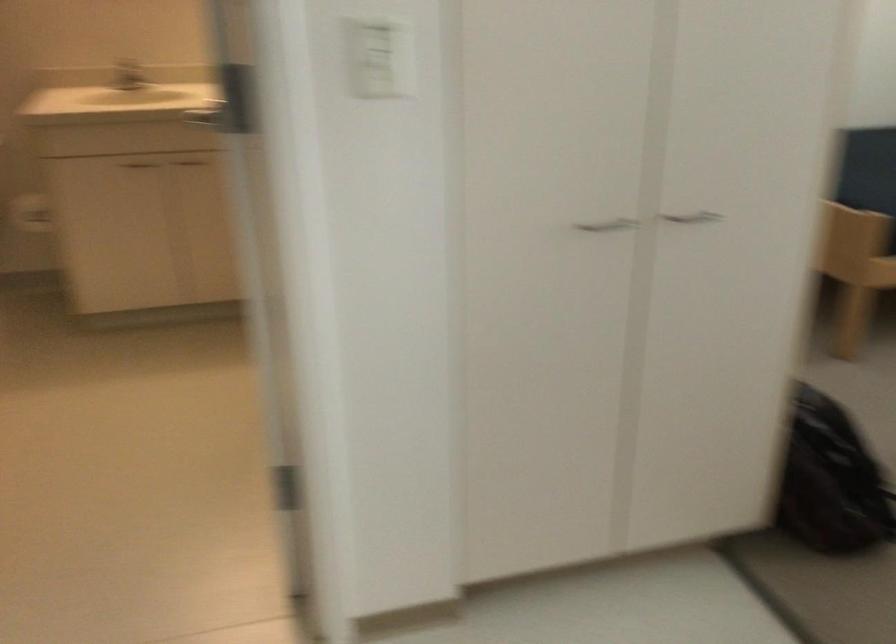
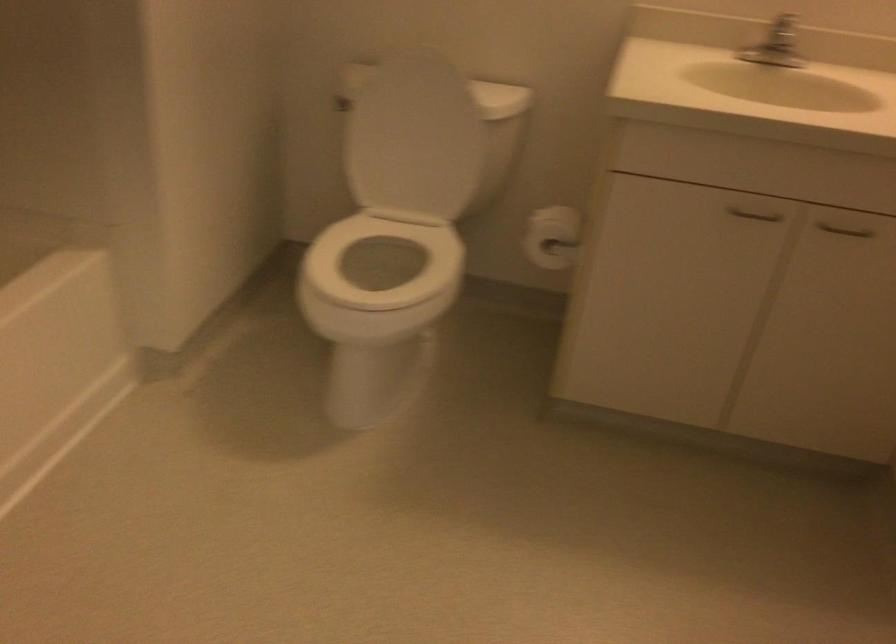
Locate, in the second image, the point that corresponds to [134,78] in the first image.

(778, 55)